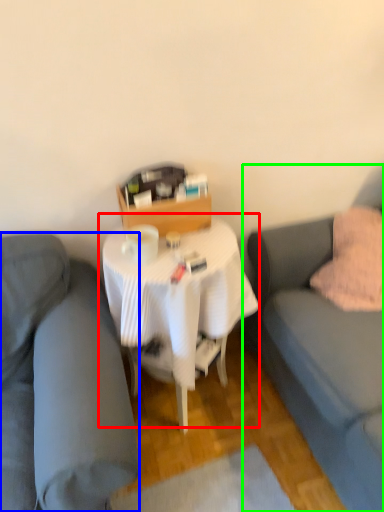
Question: Estimate the real-world distances between objects in this image. Which object is farther from table (highlighted by a red box), studio couch (highlighted by a blue box) or studio couch (highlighted by a green box)?

Choices:
 (A) studio couch
 (B) studio couch

Answer: (B)